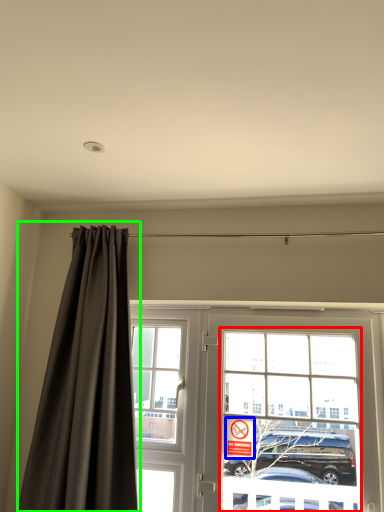
Question: Estimate the real-world distances between objects in this image. Which object is farther from bay window (highlighted by a red box), parking sign (highlighted by a blue box) or curtain (highlighted by a green box)?

Choices:
 (A) parking sign
 (B) curtain

Answer: (B)